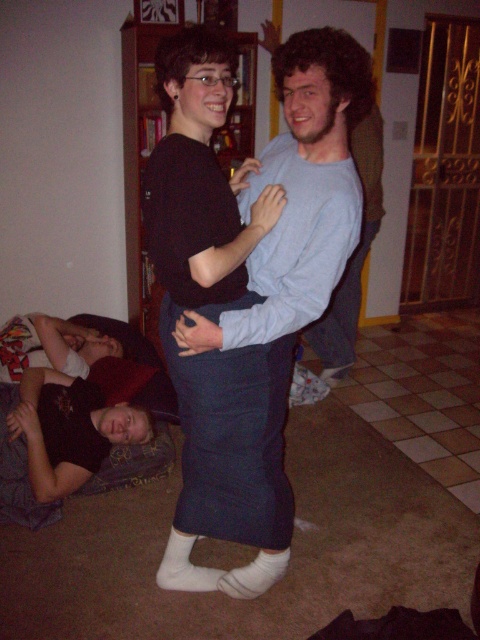
Question: Does black matte skirt at center lie in front of white cotton socks at lower center?

Choices:
 (A) yes
 (B) no

Answer: (A)

Question: Which point appears farthest from the camera in this image?

Choices:
 (A) (100, 461)
 (B) (252, 595)

Answer: (A)

Question: Can you confirm if black cotton shirt at lower left is positioned above white cotton socks at lower center?

Choices:
 (A) no
 (B) yes

Answer: (B)

Question: Is black matte skirt at center above white cotton sock at lower center?

Choices:
 (A) yes
 (B) no

Answer: (A)

Question: Which point is farther from the camera taking this photo?

Choices:
 (A) (214, 588)
 (B) (260, 566)

Answer: (A)

Question: Which point appears farthest from the camera in this image?

Choices:
 (A) (194, 538)
 (B) (47, 406)
 (C) (227, 52)
 (D) (238, 586)

Answer: (B)